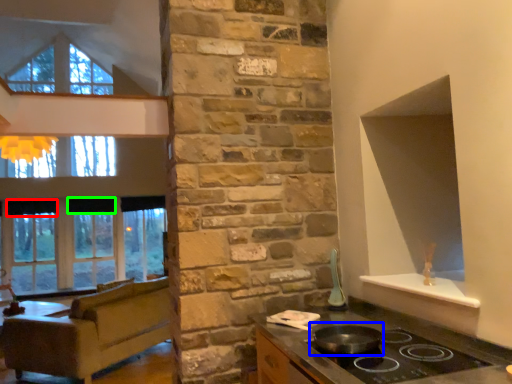
Question: Based on their relative distances, which object is nearer to curtain (highlighted by a red box)? Choose from wok (highlighted by a blue box) and curtain (highlighted by a green box).

Choices:
 (A) wok
 (B) curtain

Answer: (B)